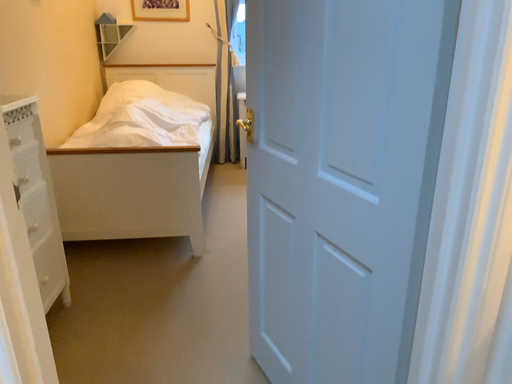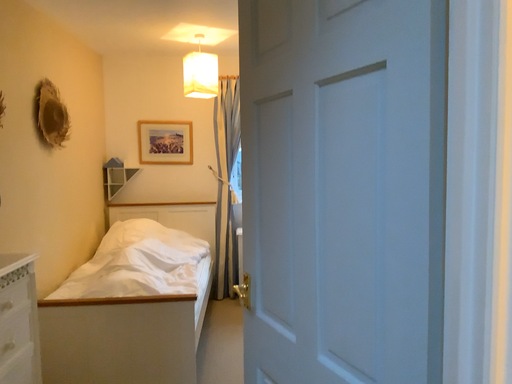
Question: How did the camera likely rotate when shooting the video?

Choices:
 (A) rotated downward
 (B) rotated upward

Answer: (B)